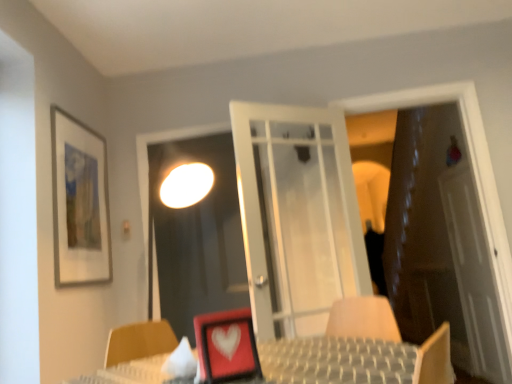
Question: Is white translucent screen door at right, which is counted as the 1th screen door, starting from the back, bigger than brown leather door at right?

Choices:
 (A) yes
 (B) no

Answer: (B)

Question: Is white translucent screen door at right, marked as the 1th screen door in a right-to-left arrangement, wider than brown leather door at right?

Choices:
 (A) no
 (B) yes

Answer: (A)

Question: Is white translucent screen door at right, which is counted as the 1th screen door, starting from the back, placed right next to brown leather door at right?

Choices:
 (A) yes
 (B) no

Answer: (B)

Question: Is white translucent screen door at right, which is counted as the 1th screen door, starting from the back, not inside brown leather door at right?

Choices:
 (A) yes
 (B) no

Answer: (A)

Question: From the image's perspective, would you say white translucent screen door at right, marked as the 1th screen door in a right-to-left arrangement, is positioned over brown leather door at right?

Choices:
 (A) no
 (B) yes

Answer: (A)

Question: Can you confirm if white translucent screen door at right, positioned as the 2th screen door in left-to-right order, is smaller than brown leather door at right?

Choices:
 (A) yes
 (B) no

Answer: (A)

Question: Is matte red picture frame at center, which is the first picture frame from front to back, a part of transparent glass screen door at center, the second screen door from the back?

Choices:
 (A) no
 (B) yes

Answer: (A)

Question: Is transparent glass screen door at center, which is counted as the second screen door, starting from the right, not near matte red picture frame at center, which is the first picture frame in right-to-left order?

Choices:
 (A) no
 (B) yes

Answer: (B)

Question: From the image's perspective, is transparent glass screen door at center, the first screen door in the left-to-right sequence, above matte red picture frame at center, which is the first picture frame from front to back?

Choices:
 (A) yes
 (B) no

Answer: (A)

Question: Can we say transparent glass screen door at center, the second screen door from the back, lies outside matte red picture frame at center, which is the first picture frame from front to back?

Choices:
 (A) no
 (B) yes

Answer: (B)

Question: Does transparent glass screen door at center, which is counted as the second screen door, starting from the right, have a greater height compared to matte red picture frame at center, which is the first picture frame in right-to-left order?

Choices:
 (A) no
 (B) yes

Answer: (B)

Question: Is transparent glass screen door at center, the second screen door from the back, positioned before matte red picture frame at center, which is the first picture frame in right-to-left order?

Choices:
 (A) yes
 (B) no

Answer: (B)

Question: Considering the relative sizes of brown leather door at right and white translucent screen door at right, which is counted as the 1th screen door, starting from the back, in the image provided, is brown leather door at right taller than white translucent screen door at right, which is counted as the 1th screen door, starting from the back,?

Choices:
 (A) no
 (B) yes

Answer: (B)